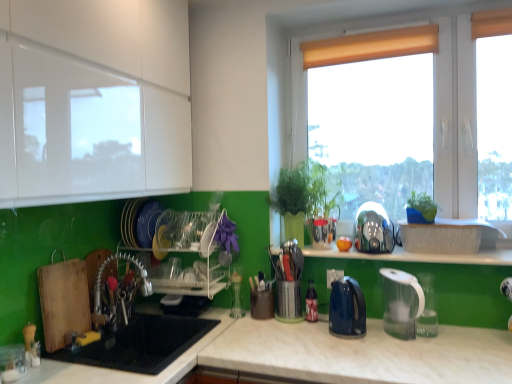
Identify the location of free space above beige fabric curtain at upper center (from a real-world perspective). This screenshot has width=512, height=384. (365, 33).